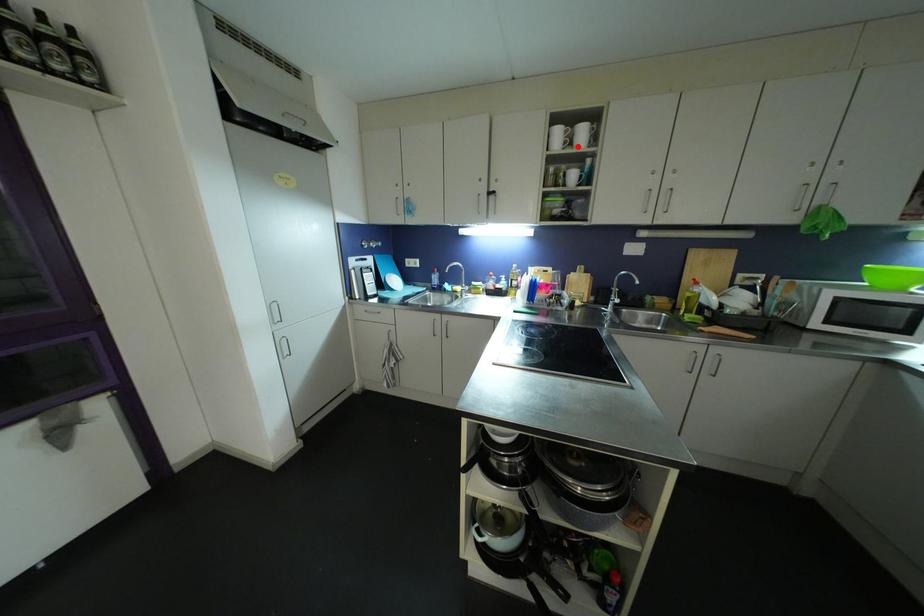
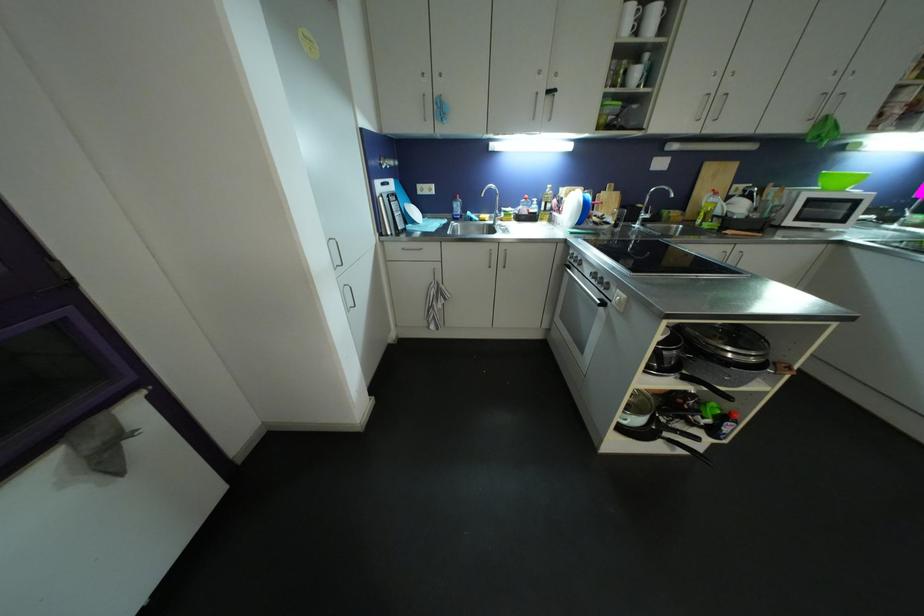
Question: I am providing you with two images of the same scene from different viewpoints. Given a red point in image1, look at the same physical point in image2. Is it:

Choices:
 (A) Closer to the viewpoint
 (B) Farther from the viewpoint

Answer: (B)